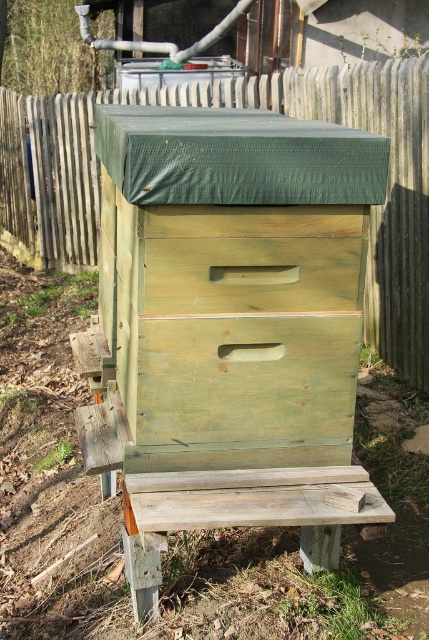
From the picture: You are standing in front of the wooden beehive and notice two points marked on the structure. The first point is at coordinate point (390, 211) and the second at point (305, 563). Which point is closer to your eyes?

Point (305, 563) is closer to your eyes because it is less further to the camera than point (390, 211).

Looking at this image, you are a gardener who needs to move a 2.5 meter long ladder from the weathered wood bench at lower center to the weathered wood fence at upper center. Can you carry the ladder horizontally without tilting it? Please explain your reasoning based on the distance between them.

The distance between the weathered wood fence at upper center and the weathered wood bench at lower center is 2.43 meters. Since the ladder is 2.5 meters long, it is slightly longer than the space available. Therefore, you cannot carry the ladder horizontally without tilting it to shorten its effective length.